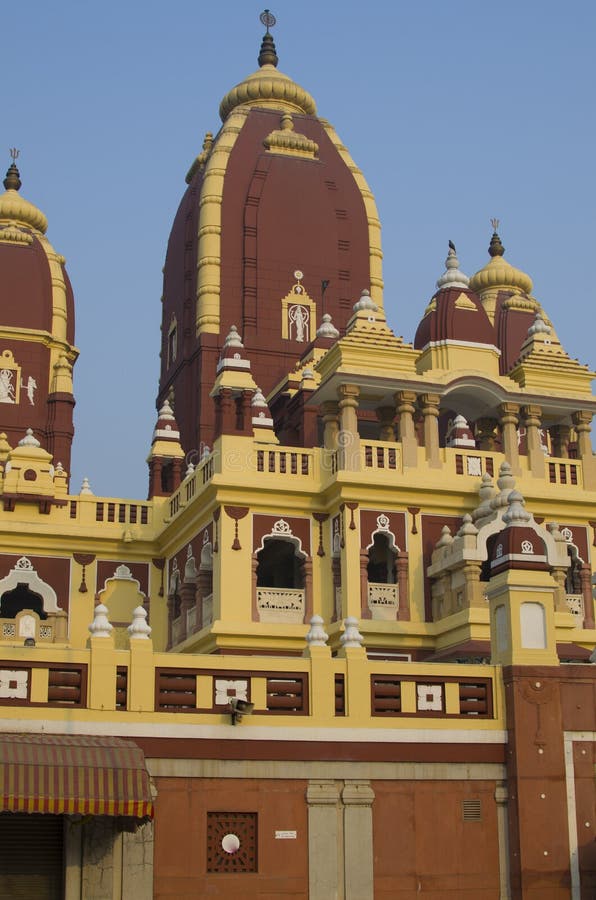
You are a GUI agent. You are given a task and a screenshot of the screen. Output one action in this format:
    pyautogui.click(x=<x>, y=<y>)
    Task: Click on the entrance
    The image size is (596, 900).
    Given the screenshot: What is the action you would take?
    pyautogui.click(x=32, y=864)